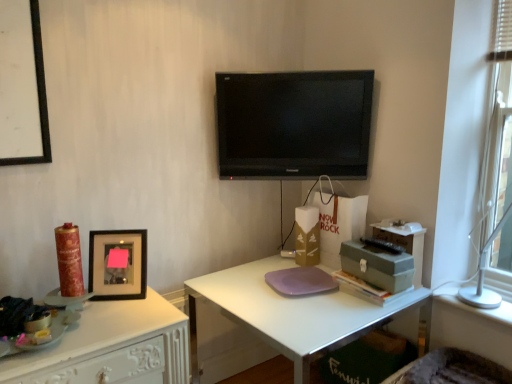
Find the location of a particular element. The width and height of the screenshot is (512, 384). empty space that is ontop of white glossy desk at left, placed as the 2th desk when sorted from right to left (from a real-world perspective) is located at coordinates (96, 315).